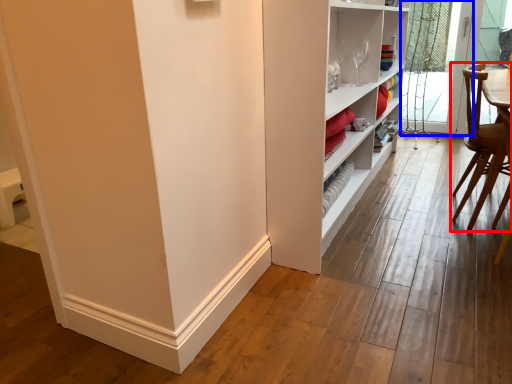
Question: Which point is further to the camera, chair (highlighted by a red box) or screen door (highlighted by a blue box)?

Choices:
 (A) chair
 (B) screen door

Answer: (B)